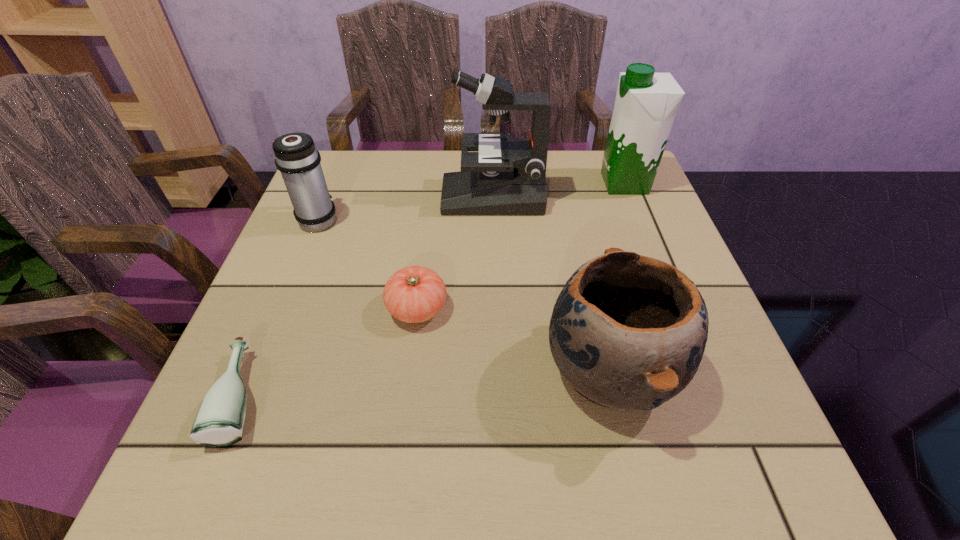
Identify the location of vacant point located 0.190m on the front-facing side of the soya milk. The height and width of the screenshot is (540, 960). (526, 184).

Where is `blank space located on the front-facing side of the soya milk`? blank space located on the front-facing side of the soya milk is located at coordinates (522, 184).

Locate an element on the screen. This screenshot has height=540, width=960. blank area located on the side with the handle of the thermos bottle is located at coordinates (340, 167).

At what (x,y) coordinates should I click in order to perform the action: click on free space located 0.140m on the side with the handle of the thermos bottle. Please return your answer as a coordinate pair (x, y). Image resolution: width=960 pixels, height=540 pixels. Looking at the image, I should click on (337, 173).

Find the location of a particular element. vacant space situated 0.200m on the side with the handle of the thermos bottle is located at coordinates (343, 161).

Locate an element on the screen. free space located on the left of the pottery is located at coordinates (368, 371).

Locate an element on the screen. free space located on the front of the second shortest object is located at coordinates click(x=396, y=472).

Where is `vacant space situated on the back of the bottle`? Image resolution: width=960 pixels, height=540 pixels. vacant space situated on the back of the bottle is located at coordinates (297, 268).

Where is `microscope located in the far edge section of the desktop`? The height and width of the screenshot is (540, 960). microscope located in the far edge section of the desktop is located at coordinates (507, 176).

Find the location of a particular element. The height and width of the screenshot is (540, 960). soya milk situated at the far edge is located at coordinates (646, 103).